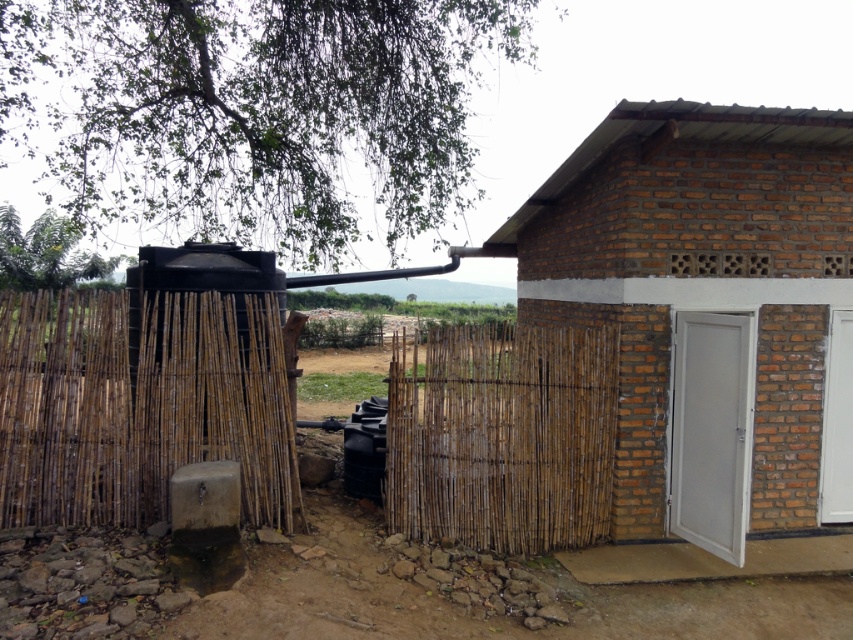
You are standing at the point marked by coordinates point (x=708, y=310). Looking around, you see the brown brick door at center. What is the direction of the open white door on the right side of the brown brick door at center from your current position?

The open white door on the right side of the brown brick door at center is located to the right of your current position marked by point (x=708, y=310).

You are standing in front of the small brick structure and want to see if there is a path between the bamboo fence at left and the bamboo fence at center. Can you see through or between them?

The bamboo fence at left is in front of the bamboo fence at center, so you cannot see through or between them because the bamboo fence at left blocks the view of the bamboo fence at center.